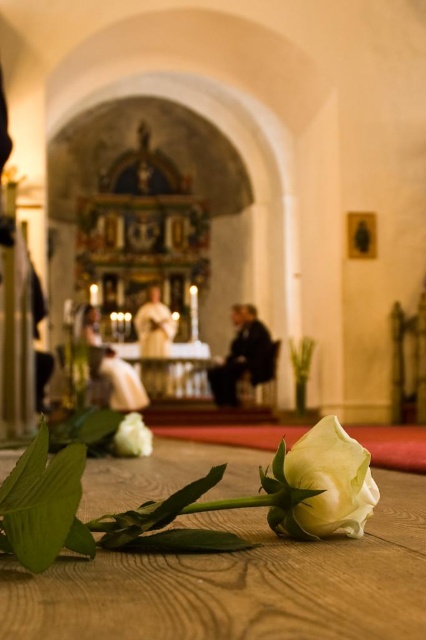
You are an interior designer planning to place a new decorative item in the chapel. You have a small statue that needs to be placed near the white matte rose at center. Considering the wooden table at lower center is larger than the rose, where should you place the statue to ensure it doesn

Since the wooden table at lower center is larger than the white matte rose at center, you should place the statue on the wooden table at lower center to ensure there is enough space for it.

You are standing in the chapel and notice the wooden table at lower center and the white matte rose at center. Which object is nearer to you?

The wooden table at lower center is closer to the viewer than the white matte rose at center, so the wooden table at lower center is nearer to you.